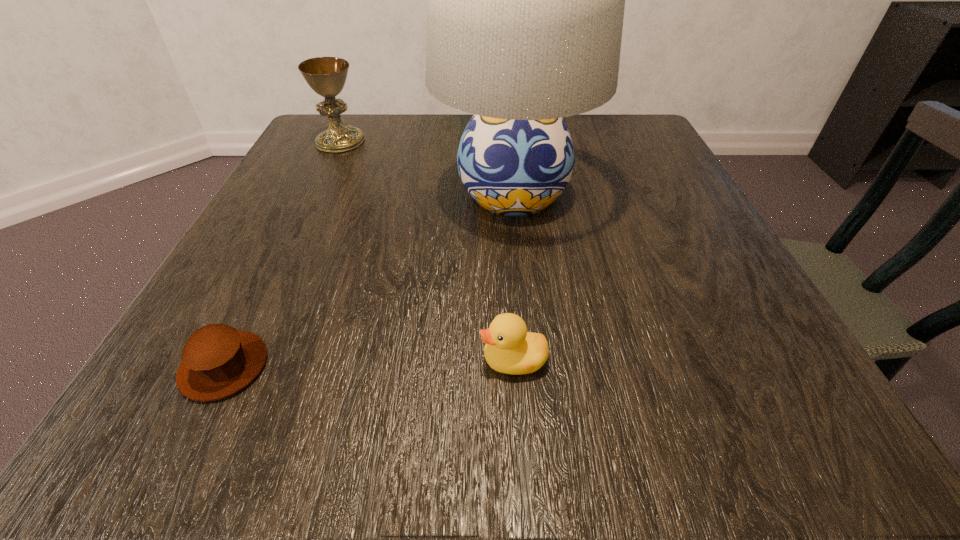
The height and width of the screenshot is (540, 960). In order to click on blank region between the farthest object and the duckling in this screenshot , I will do `click(427, 251)`.

In order to click on blank region between the shortest object and the second shortest object in this screenshot , I will do `click(369, 363)`.

Where is `free space between the second farthest object and the farthest object`? The height and width of the screenshot is (540, 960). free space between the second farthest object and the farthest object is located at coordinates (427, 167).

At what (x,y) coordinates should I click in order to perform the action: click on free area in between the farthest object and the third tallest object. Please return your answer as a coordinate pair (x, y). The height and width of the screenshot is (540, 960). Looking at the image, I should click on (427, 251).

Identify the location of empty location between the second farthest object and the duckling. (514, 276).

Locate an element on the screen. object that is the third closest to the duckling is located at coordinates (327, 76).

Locate which object is the third closest to the chalice. Please provide its 2D coordinates. Your answer should be formatted as a tuple, i.e. [(x, y)], where the tuple contains the x and y coordinates of a point satisfying the conditions above.

[(509, 348)]

The height and width of the screenshot is (540, 960). I want to click on free space that satisfies the following two spatial constraints: 1. on the face of the duckling; 2. on the front side of the shortest object, so pos(514,366).

Where is `vacant space that satisfies the following two spatial constraints: 1. on the front-facing side of the second farthest object; 2. on the face of the third tallest object`? vacant space that satisfies the following two spatial constraints: 1. on the front-facing side of the second farthest object; 2. on the face of the third tallest object is located at coordinates (530, 360).